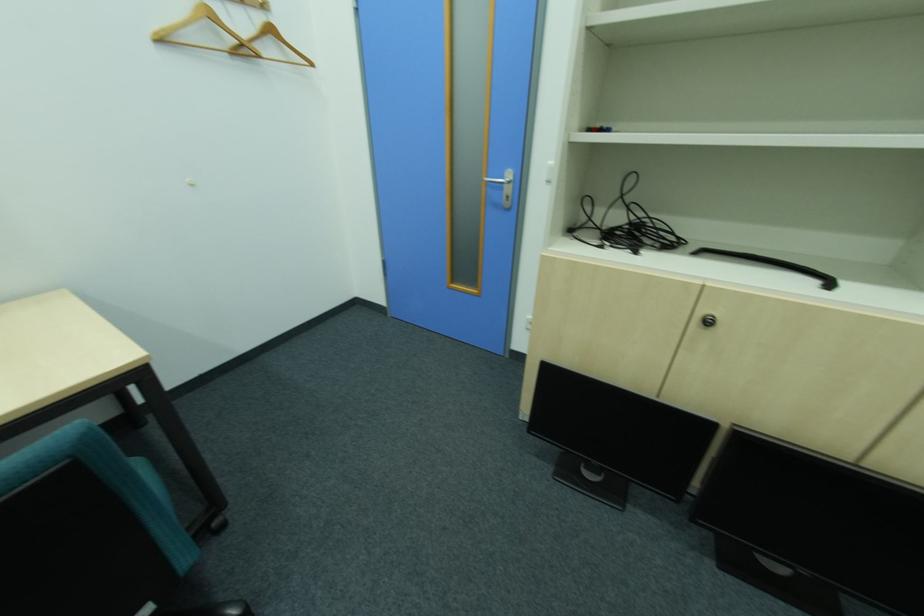
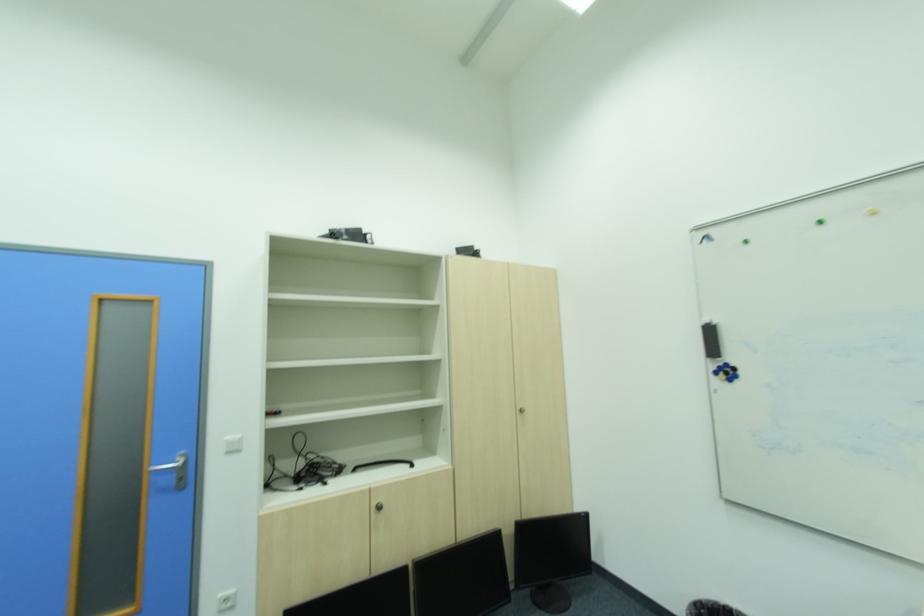
Find the pixel in the second image that matches (722,427) in the first image.

(411, 570)